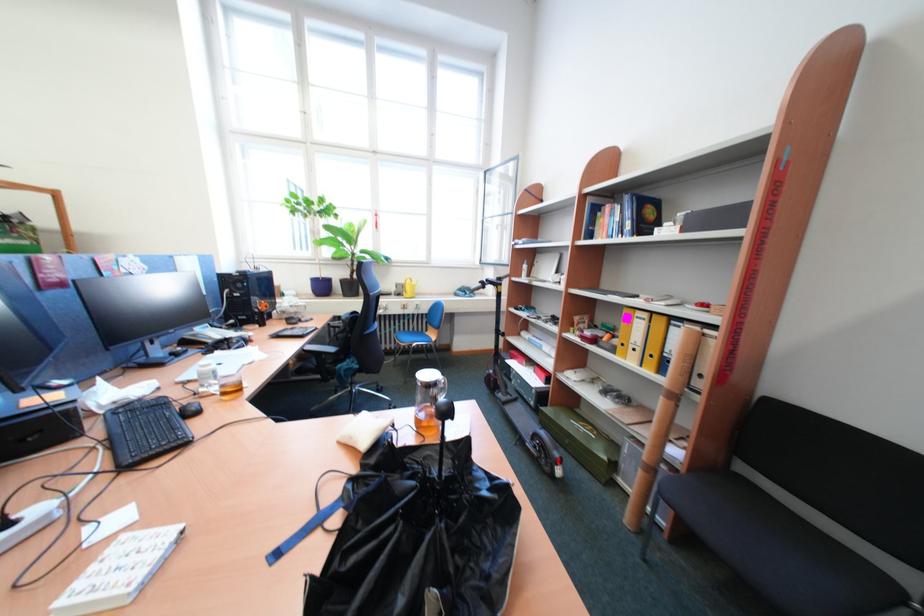
Identify the location of black computer mouse. (189, 410).